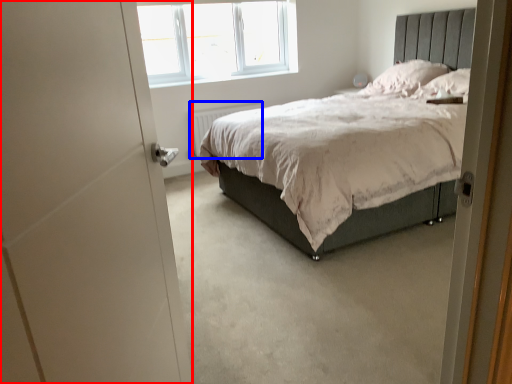
Question: Which object is closer to the camera taking this photo, screen door (highlighted by a red box) or radiator (highlighted by a blue box)?

Choices:
 (A) screen door
 (B) radiator

Answer: (A)